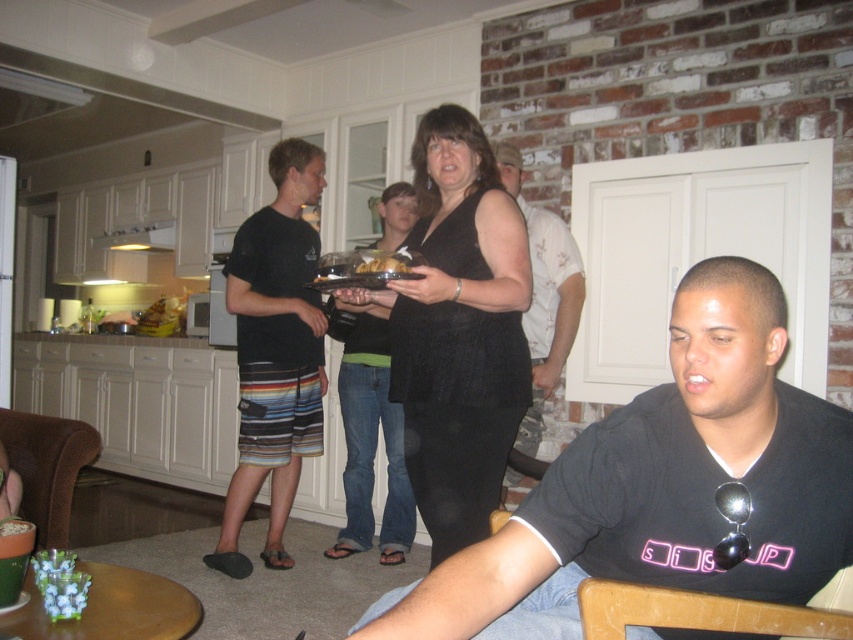
Question: Which object is farther from the camera taking this photo?

Choices:
 (A) black matte vest at center
 (B) matte black shirt at center
 (C) black striped shorts at left

Answer: (C)

Question: Can you confirm if black matte shirt at lower right is bigger than black matte tank top at center?

Choices:
 (A) no
 (B) yes

Answer: (A)

Question: Considering the real-world distances, which object is closest to the black matte shirt at lower right?

Choices:
 (A) black matte vest at center
 (B) brown crumbly cake at center
 (C) black matte tank top at center
 (D) black striped shorts at left

Answer: (A)

Question: Is black striped shorts at left wider than brown crumbly cake at center?

Choices:
 (A) yes
 (B) no

Answer: (A)

Question: Is black matte vest at center above black matte tank top at center?

Choices:
 (A) no
 (B) yes

Answer: (B)

Question: Which point is closer to the camera?

Choices:
 (A) (821, 442)
 (B) (358, 532)

Answer: (A)